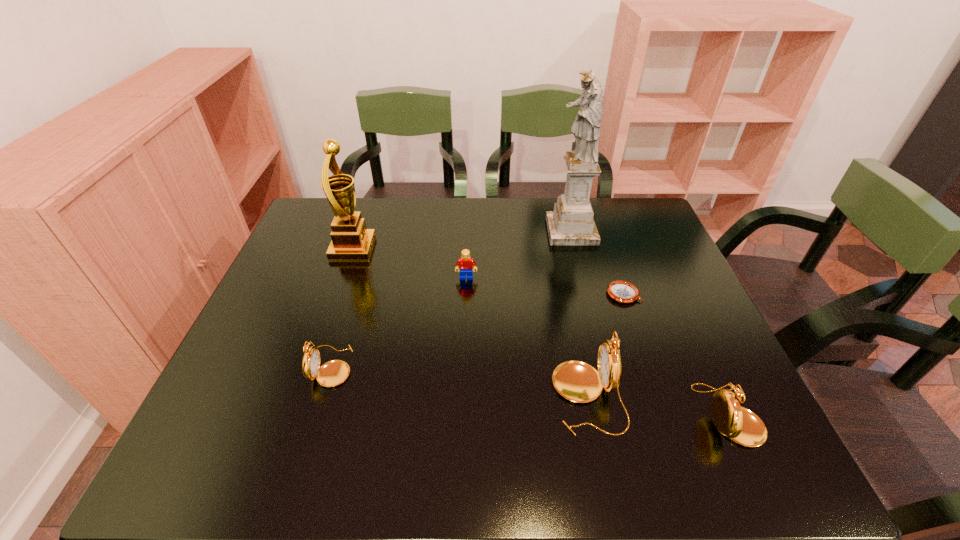
Find the location of `vacant space that's between the leftmost pocket watch and the second tallest pocket watch`. vacant space that's between the leftmost pocket watch and the second tallest pocket watch is located at coordinates tap(530, 390).

Identify the location of vacant area that lies between the rightmost object and the fourth nearest object. This screenshot has height=540, width=960. (676, 354).

Locate an element on the screen. free area in between the fifth object from right to left and the tallest object is located at coordinates (518, 254).

Find the location of a particular element. object that ranks as the second closest to the third tallest object is located at coordinates (620, 291).

Locate which object ranks second in proximity to the award. Please provide its 2D coordinates. Your answer should be formatted as a tuple, i.e. [(x, y)], where the tuple contains the x and y coordinates of a point satisfying the conditions above.

[(335, 372)]

Point out which pocket watch is positioned as the second nearest to the fifth shortest object. Please provide its 2D coordinates. Your answer should be formatted as a tuple, i.e. [(x, y)], where the tuple contains the x and y coordinates of a point satisfying the conditions above.

[(335, 372)]

Identify which pocket watch is the second nearest to the tallest pocket watch. Please provide its 2D coordinates. Your answer should be formatted as a tuple, i.e. [(x, y)], where the tuple contains the x and y coordinates of a point satisfying the conditions above.

[(335, 372)]

The width and height of the screenshot is (960, 540). I want to click on free region that satisfies the following two spatial constraints: 1. on the front-facing side of the fourth farthest object; 2. on the right side of the award, so click(x=337, y=294).

I want to click on vacant space that satisfies the following two spatial constraints: 1. on the front-facing side of the shortest object; 2. on the left side of the Lego, so coord(466,294).

Identify the location of free space that satisfies the following two spatial constraints: 1. on the front-facing side of the tallest object; 2. on the back side of the fourth nearest object. The width and height of the screenshot is (960, 540). (588, 294).